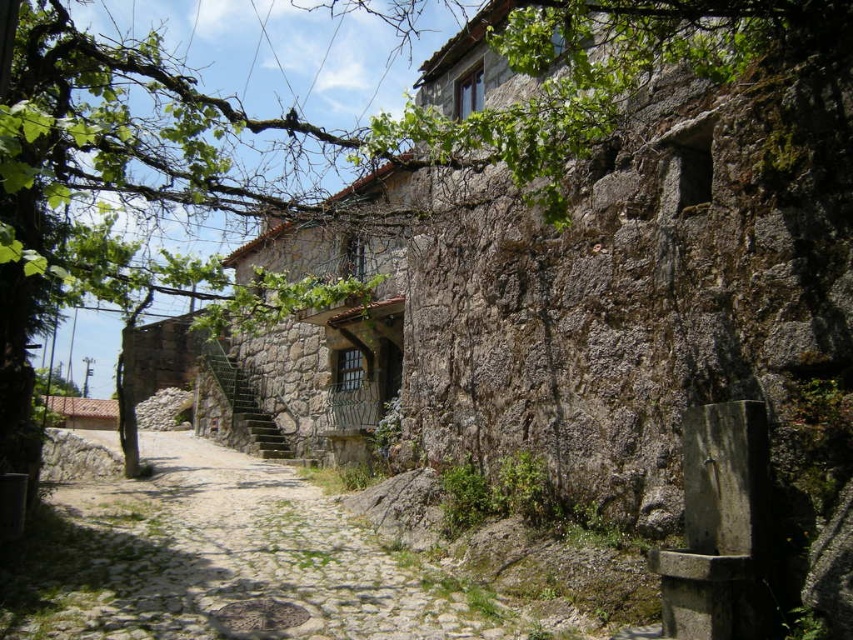
You are standing at the entrance of the stone building and want to walk to the cobblestone path at center. Which direction should you turn to avoid the rustic stone stairs at center?

The cobblestone path at center is on the right side of rustic stone stairs at center, so you should turn to the left to avoid the stairs and head towards the path.

You are a delivery person carrying a heavy package and need to reach the front door of the stone building. You see the cobblestone path at center and the rustic stone stairs at center. Which path is shorter and therefore easier to navigate with your load?

The cobblestone path at center is shorter than the rustic stone stairs at center, so it would be easier to navigate with your heavy package.

You are standing in front of the stone building and want to determine which of the two points, point (288,520) or point (254,426), is nearer to you. Based on the scene, which point is closer?

Point (288,520) is closer to the viewer than point (254,426), so it is the nearer one.